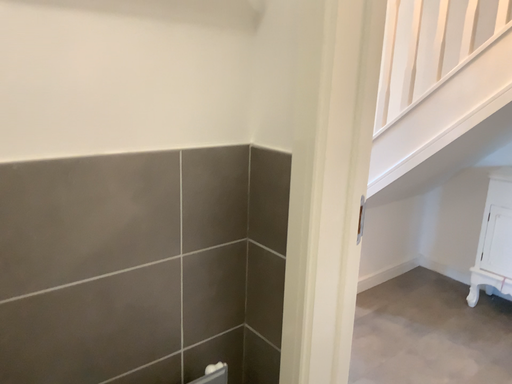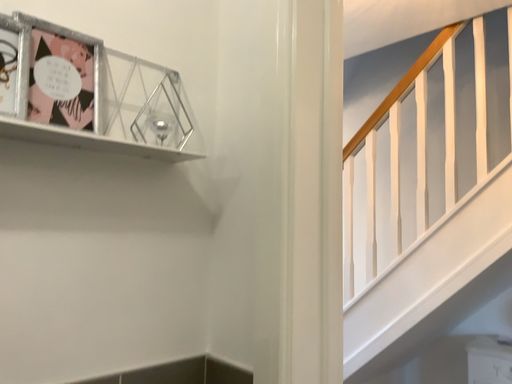
Question: Which way did the camera rotate in the video?

Choices:
 (A) rotated downward
 (B) rotated upward

Answer: (B)